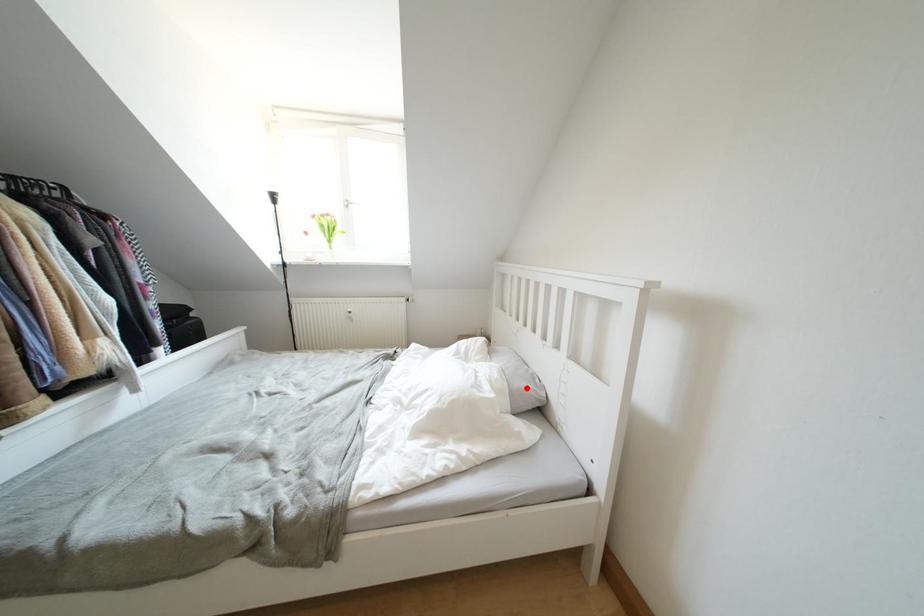
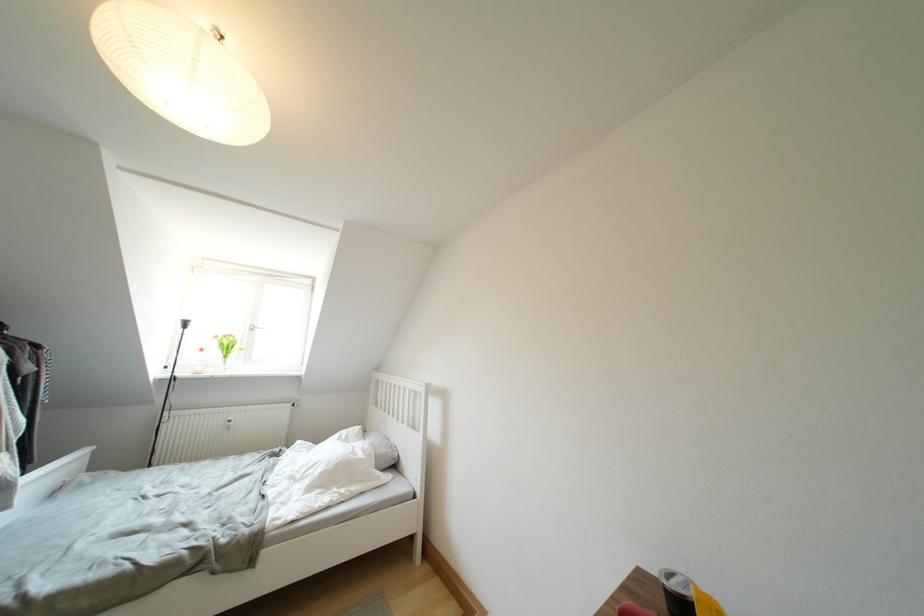
In the second image, find the point that corresponds to the highlighted location in the first image.

(388, 454)